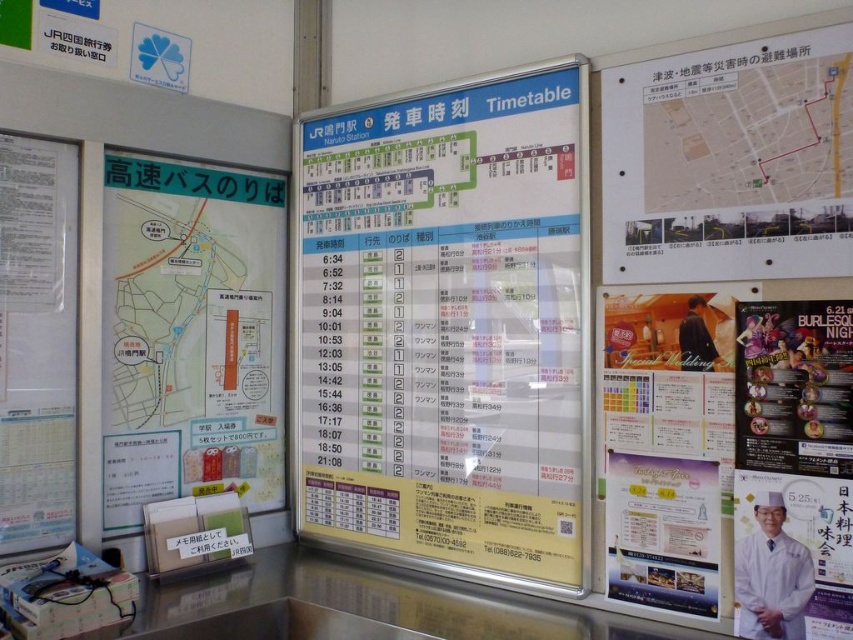
You are a traveler holding a 1.5 meter long poster and want to place it between the white paper timetable at center and the other board to the left. Is there enough space?

The distance between the white paper timetable at center and the other board to the left is 1.52 meters. Since the poster is 1.5 meters long, there is just enough space to place it between them.

You are a traveler at JR Naruto Station looking for the bus schedule. You see the white paper timetable at center and the matte green map at left. Which object should you check first to find bus route information?

The matte green map at left is the correct object to check for bus route information because it is positioned to the left of the white paper timetable at center, and the description mentions it contains additional information related to bus routes or travel directions.

You are at the station and need to find the white paper timetable at center. According to the scene description, where exactly is it located?

The white paper timetable at center is located at point (447,328).